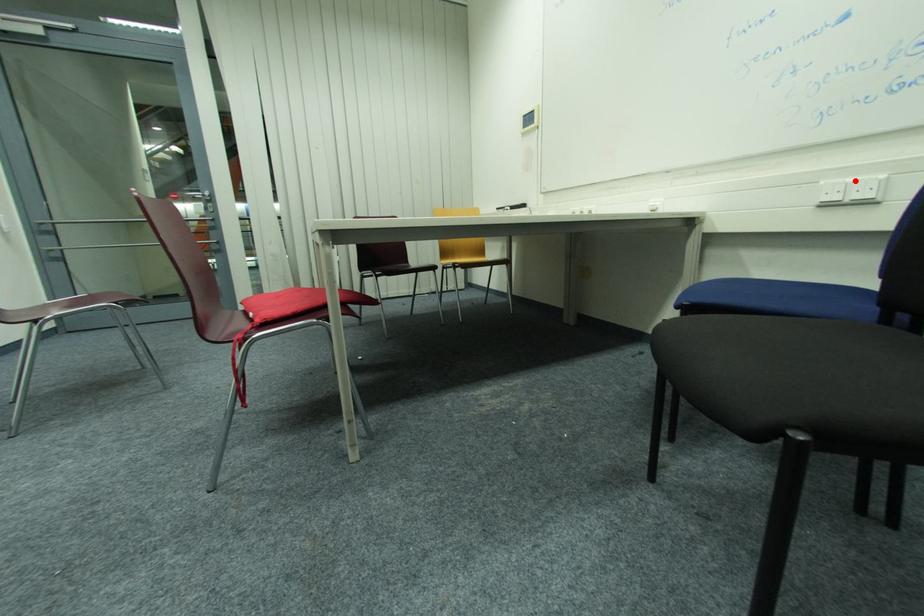
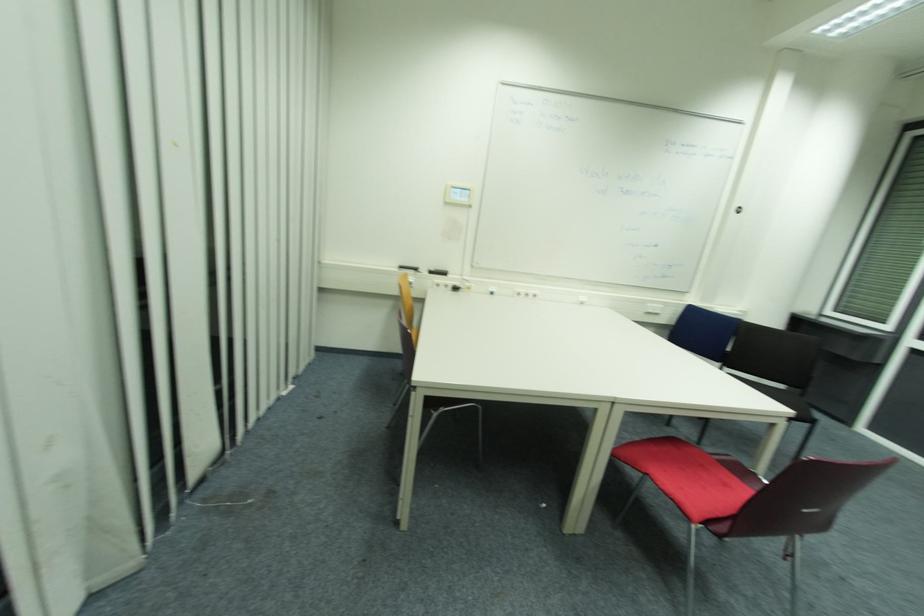
Locate, in the second image, the point that corresponds to the highlighted location in the first image.

(658, 306)